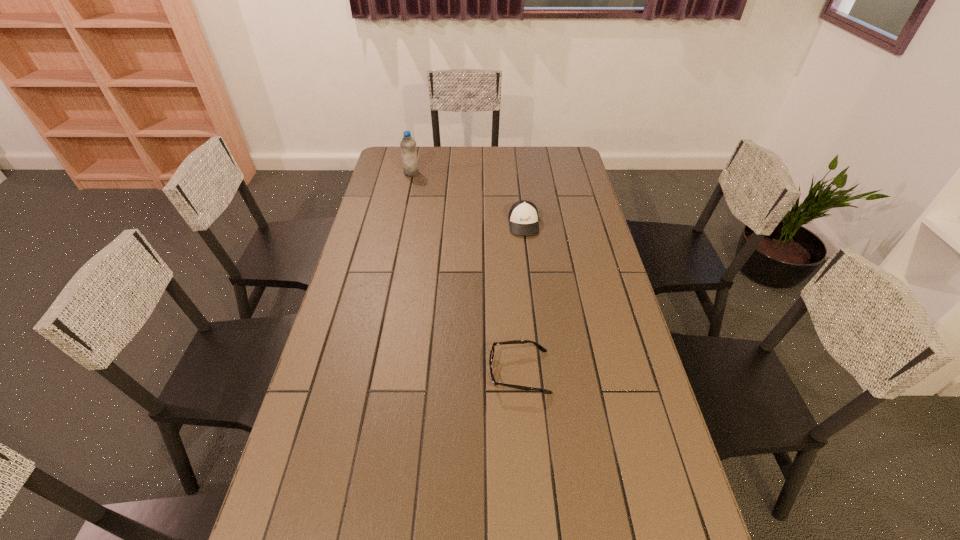
Find the location of a particular element. vacant point located between the second farthest object and the shortest object is located at coordinates (521, 298).

At what (x,y) coordinates should I click in order to perform the action: click on free space between the water bottle and the second nearest object. Please return your answer as a coordinate pair (x, y). The width and height of the screenshot is (960, 540). Looking at the image, I should click on (468, 199).

Where is `empty location between the tallest object and the shortest object`? The height and width of the screenshot is (540, 960). empty location between the tallest object and the shortest object is located at coordinates (466, 273).

Locate which object ranks in proximity to the cap. Please provide its 2D coordinates. Your answer should be formatted as a tuple, i.e. [(x, y)], where the tuple contains the x and y coordinates of a point satisfying the conditions above.

[(408, 145)]

I want to click on object that ranks as the second closest to the second tallest object, so click(539, 346).

What are the coordinates of `vacant space that satisfies the following two spatial constraints: 1. on the front panel of the cap; 2. on the front-facing side of the nearest object` in the screenshot? It's located at (541, 372).

Locate an element on the screen. The width and height of the screenshot is (960, 540). vacant space that satisfies the following two spatial constraints: 1. on the front panel of the second farthest object; 2. on the front-facing side of the spectacles is located at coordinates (541, 372).